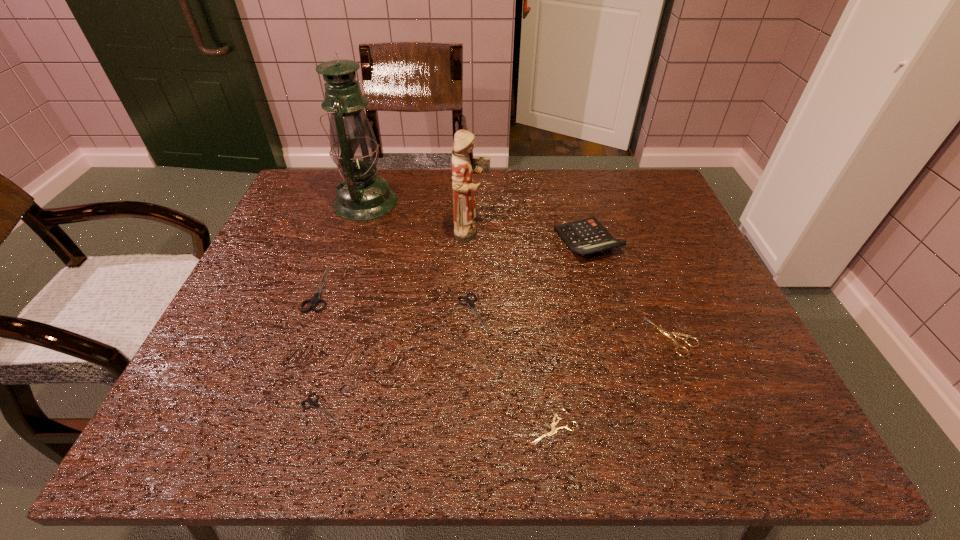
In order to click on free space between the seventh shortest object and the tallest object in this screenshot , I will do `click(419, 217)`.

You are a GUI agent. You are given a task and a screenshot of the screen. Output one action in this format:
    pyautogui.click(x=<x>, y=<y>)
    Task: Click on the free point between the tallest object and the figurine
    
    Given the screenshot: What is the action you would take?
    pyautogui.click(x=419, y=217)

Identify which object is located as the sixth nearest to the left beige shears. Please provide its 2D coordinates. Your answer should be formatted as a tuple, i.e. [(x, y)], where the tuple contains the x and y coordinates of a point satisfying the conditions above.

[(316, 299)]

Locate which object ranks sixth in proximity to the second black shears from right to left. Please provide its 2D coordinates. Your answer should be formatted as a tuple, i.e. [(x, y)], where the tuple contains the x and y coordinates of a point satisfying the conditions above.

[(586, 236)]

Point out which shears is positioned as the nearest to the right beige shears. Please provide its 2D coordinates. Your answer should be formatted as a tuple, i.e. [(x, y)], where the tuple contains the x and y coordinates of a point satisfying the conditions above.

[(554, 430)]

I want to click on shears that is the fourth closest one to the tallest object, so click(x=554, y=430).

Where is `black shears that is the closest to the seventh shortest object`? Image resolution: width=960 pixels, height=540 pixels. black shears that is the closest to the seventh shortest object is located at coordinates (470, 303).

Where is `the second closest black shears to the nearest black shears`? This screenshot has width=960, height=540. the second closest black shears to the nearest black shears is located at coordinates tap(470, 303).

I want to click on vacant area in the image that satisfies the following two spatial constraints: 1. on the front-facing side of the calculator; 2. on the right side of the figurine, so click(471, 241).

Where is `free space that satisfies the following two spatial constraints: 1. on the front-facing side of the sixth shortest object; 2. on the right side of the figurine`? Image resolution: width=960 pixels, height=540 pixels. free space that satisfies the following two spatial constraints: 1. on the front-facing side of the sixth shortest object; 2. on the right side of the figurine is located at coordinates (471, 241).